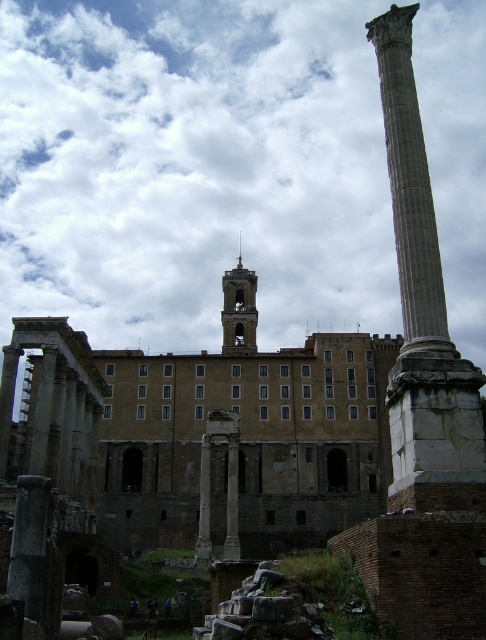
You are an archaeologist examining the ancient Roman site. You notice the gray stone column at right and the smooth stone tower at center. Which of these two structures is bigger in size?

The gray stone column at right has a larger size compared to the smooth stone tower at center, so the gray stone column at right is bigger.

You are standing at the historical site and want to take a photo of both point (483, 380) and point (221, 320). Which point will appear larger in your photo?

Point (483, 380) is closer to the camera than point (221, 320), so it will appear larger in the photo.